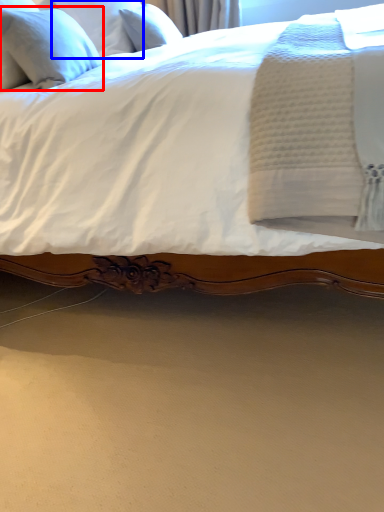
Question: Which object is closer to the camera taking this photo, pillow (highlighted by a red box) or pillow (highlighted by a blue box)?

Choices:
 (A) pillow
 (B) pillow

Answer: (A)